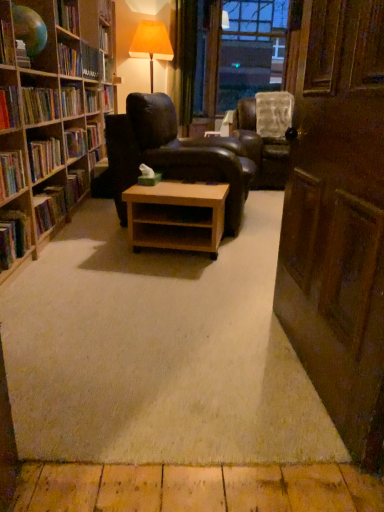
Question: Is transparent plastic window screen at upper center far away from leather armchair at center, arranged as the 2th chair when viewed from the left?

Choices:
 (A) yes
 (B) no

Answer: (A)

Question: From the image's perspective, does transparent plastic window screen at upper center appear higher than leather armchair at center, the 2th chair when ordered from front to back?

Choices:
 (A) yes
 (B) no

Answer: (A)

Question: From a real-world perspective, is transparent plastic window screen at upper center on top of leather armchair at center, which is counted as the 1th chair, starting from the back?

Choices:
 (A) no
 (B) yes

Answer: (B)

Question: Is transparent plastic window screen at upper center located outside leather armchair at center, the 2th chair when ordered from front to back?

Choices:
 (A) no
 (B) yes

Answer: (B)

Question: Is transparent plastic window screen at upper center at the right side of leather armchair at center, which is counted as the 1th chair, starting from the back?

Choices:
 (A) no
 (B) yes

Answer: (B)

Question: Is transparent plastic window screen at upper center oriented towards leather armchair at center, arranged as the 2th chair when viewed from the left?

Choices:
 (A) no
 (B) yes

Answer: (B)

Question: Considering the relative sizes of leather armchair at center, the 2th chair when ordered from front to back, and hardcover book at upper left, placed as the second book when sorted from back to front, in the image provided, is leather armchair at center, the 2th chair when ordered from front to back, taller than hardcover book at upper left, placed as the second book when sorted from back to front,?

Choices:
 (A) yes
 (B) no

Answer: (A)

Question: Is leather armchair at center, the 2th chair when ordered from front to back, beside hardcover book at upper left, marked as the fifth book in a front-to-back arrangement?

Choices:
 (A) no
 (B) yes

Answer: (A)

Question: Can you confirm if leather armchair at center, the 2th chair when ordered from front to back, is shorter than hardcover book at upper left, the 6th book ordered from the bottom?

Choices:
 (A) yes
 (B) no

Answer: (B)

Question: Considering the relative sizes of leather armchair at center, the 2th chair when ordered from front to back, and hardcover book at upper left, the 1th book when ordered from top to bottom, in the image provided, is leather armchair at center, the 2th chair when ordered from front to back, wider than hardcover book at upper left, the 1th book when ordered from top to bottom,?

Choices:
 (A) yes
 (B) no

Answer: (A)

Question: Is leather armchair at center, which is counted as the 1th chair, starting from the back, facing away from hardcover book at upper left, the 6th book ordered from the bottom?

Choices:
 (A) no
 (B) yes

Answer: (A)

Question: Is hardcover book at upper left, the 1th book when ordered from top to bottom, completely or partially inside leather armchair at center, the 2th chair when ordered from front to back?

Choices:
 (A) no
 (B) yes

Answer: (A)

Question: Considering the relative positions of wooden bookshelf at left and hardcover book at upper left, the 6th book ordered from the bottom, in the image provided, is wooden bookshelf at left to the right of hardcover book at upper left, the 6th book ordered from the bottom, from the viewer's perspective?

Choices:
 (A) yes
 (B) no

Answer: (B)